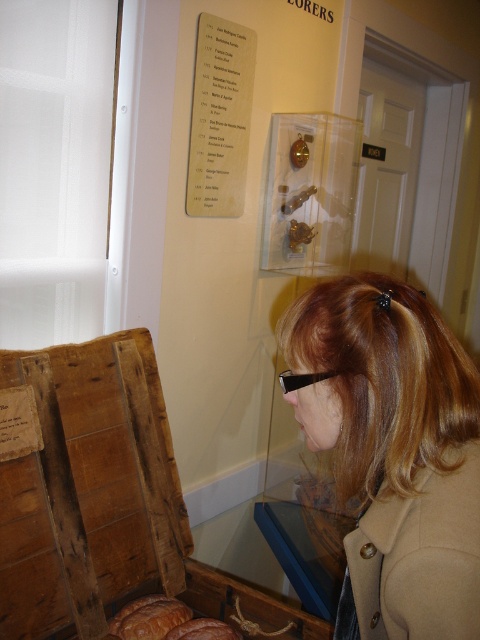
Question: Which point is farther from the camera taking this photo?

Choices:
 (A) (31, 486)
 (B) (142, 616)
 (C) (296, 381)
 (D) (422, 577)

Answer: (B)

Question: Which object is farther from the camera taking this photo?

Choices:
 (A) brown crusty bread at lower left
 (B) wooden crate at lower left

Answer: (A)

Question: In this image, where is light brown hair at center located relative to black plastic goggles at center?

Choices:
 (A) above
 (B) below

Answer: (B)

Question: Considering the real-world distances, which object is closest to the black plastic goggles at center?

Choices:
 (A) light brown hair at center
 (B) brown crusty bread at lower left

Answer: (A)

Question: Is light brown hair at center to the left of brown crusty bread at lower left from the viewer's perspective?

Choices:
 (A) no
 (B) yes

Answer: (A)

Question: Is wooden crate at lower left below brown crusty bread at lower left?

Choices:
 (A) yes
 (B) no

Answer: (B)